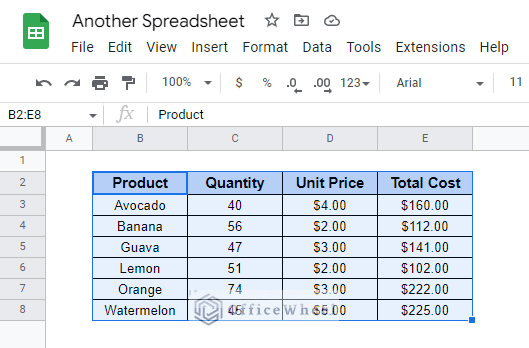
Identify the location of columns. The width and height of the screenshot is (529, 348). (71, 140), (150, 144), (242, 144), (345, 144), (431, 140).